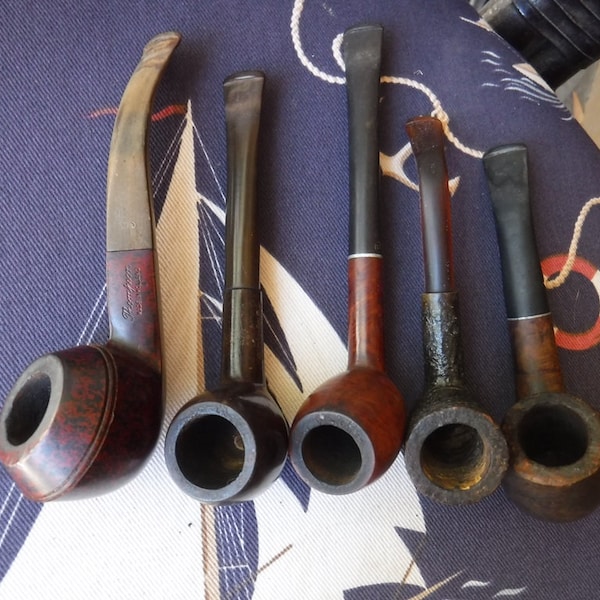
Identify the location of cloth. (31, 226).